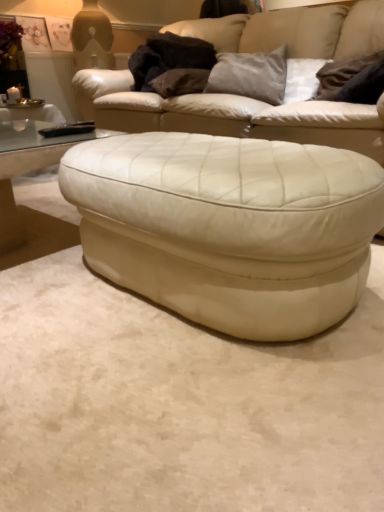
Question: Do you think white leather studio couch at center is within suede gray pillow at upper center, arranged as the 2th pillow when viewed from the right, or outside of it?

Choices:
 (A) outside
 (B) inside

Answer: (A)

Question: From their relative heights in the image, would you say white leather studio couch at center is taller or shorter than suede gray pillow at upper center, positioned as the second pillow in left-to-right order?

Choices:
 (A) short
 (B) tall

Answer: (B)

Question: Based on their relative distances, which object is farther from the velvet brown pillow at upper center, the third pillow from the right?

Choices:
 (A) velvety dark brown pillow at upper right, acting as the first pillow starting from the right
 (B) transparent glass coffee table at lower left
 (C) white leather studio couch at center
 (D) suede gray pillow at upper center, arranged as the 2th pillow when viewed from the right
 (E) black leather remote at left

Answer: (B)

Question: Estimate the real-world distances between objects in this image. Which object is closer to the velvety dark brown pillow at upper right, positioned as the 3th pillow in left-to-right order?

Choices:
 (A) black leather remote at left
 (B) white leather ottoman at center
 (C) velvet brown pillow at upper center, which is counted as the first pillow, starting from the left
 (D) white leather studio couch at center
 (E) suede gray pillow at upper center, arranged as the 2th pillow when viewed from the right

Answer: (E)